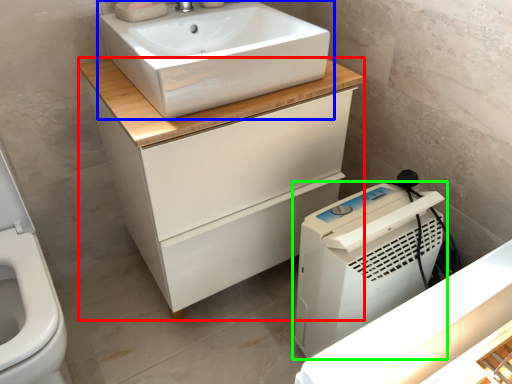
Question: Estimate the real-world distances between objects in this image. Which object is closer to bathroom cabinet (highlighted by a red box), sink (highlighted by a blue box) or home appliance (highlighted by a green box)?

Choices:
 (A) sink
 (B) home appliance

Answer: (A)